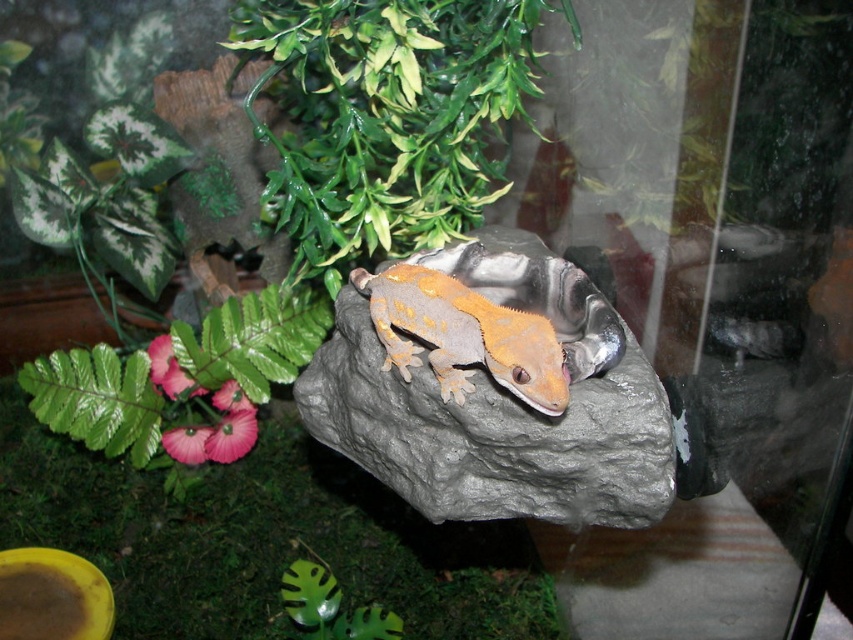
Question: Which object is the closest to the green leafy plant at lower left?

Choices:
 (A) gray matte rock at center
 (B) green leafy plant at upper center

Answer: (A)

Question: Is green leafy plant at lower left to the right of orange matte lizard at center from the viewer's perspective?

Choices:
 (A) no
 (B) yes

Answer: (A)

Question: In this image, where is green leafy plant at lower left located relative to green leafy plant at upper center?

Choices:
 (A) below
 (B) above

Answer: (A)

Question: Which object is the closest to the green leafy plant at upper center?

Choices:
 (A) orange matte lizard at center
 (B) green leafy plant at lower left
 (C) gray matte rock at center

Answer: (C)

Question: Which of the following is the farthest from the observer?

Choices:
 (A) (450, 74)
 (B) (415, 492)

Answer: (A)

Question: Is green leafy plant at upper center above orange matte lizard at center?

Choices:
 (A) yes
 (B) no

Answer: (A)